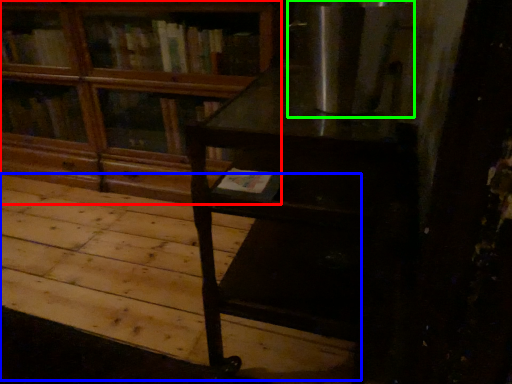
Question: Estimate the real-world distances between objects in this image. Which object is farther from bookcase (highlighted by a red box), plywood (highlighted by a blue box) or appliance (highlighted by a green box)?

Choices:
 (A) plywood
 (B) appliance

Answer: (B)